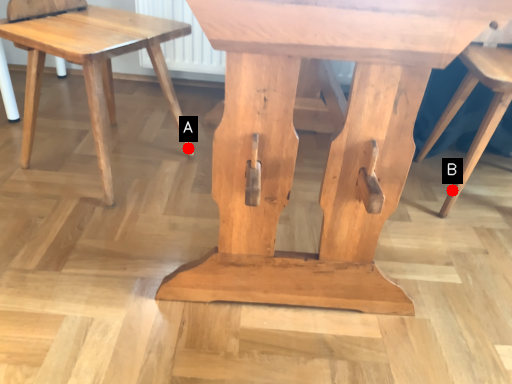
Question: Two points are circled on the image, labeled by A and B beside each circle. Among these points, which one is nearest to the camera?

Choices:
 (A) A is closer
 (B) B is closer

Answer: (B)